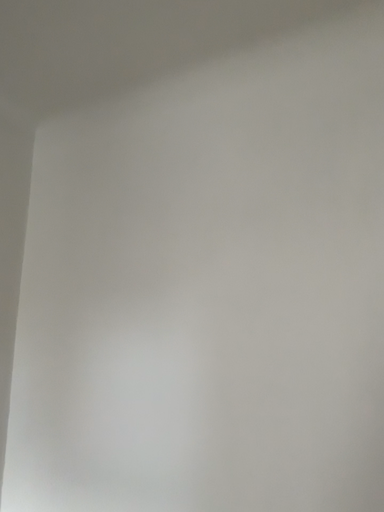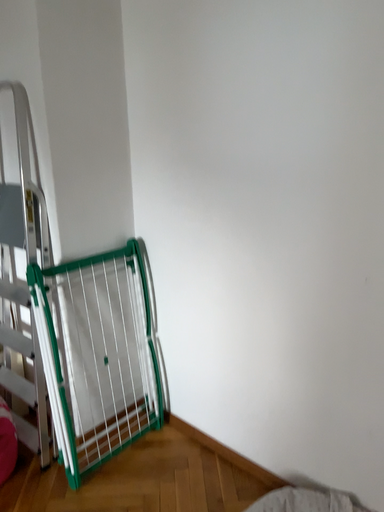
Question: How did the camera likely rotate when shooting the video?

Choices:
 (A) rotated left
 (B) rotated right

Answer: (A)